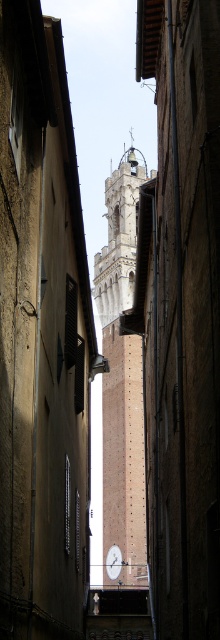
Question: Which of the following is the farthest from the observer?

Choices:
 (A) beige brick bell tower at center
 (B) white glossy clock at center

Answer: (B)

Question: In this image, where is beige brick bell tower at center located relative to white glossy clock at center?

Choices:
 (A) left
 (B) right

Answer: (B)

Question: Which object is farther from the camera taking this photo?

Choices:
 (A) beige stone bell tower at center
 (B) beige brick bell tower at center

Answer: (A)

Question: Can you confirm if beige brick bell tower at center is thinner than white glossy clock at center?

Choices:
 (A) yes
 (B) no

Answer: (B)

Question: Is beige brick bell tower at center to the right of beige stone bell tower at center from the viewer's perspective?

Choices:
 (A) yes
 (B) no

Answer: (B)

Question: Among these points, which one is nearest to the camera?

Choices:
 (A) (108, 548)
 (B) (133, 216)
 (C) (124, 253)

Answer: (A)